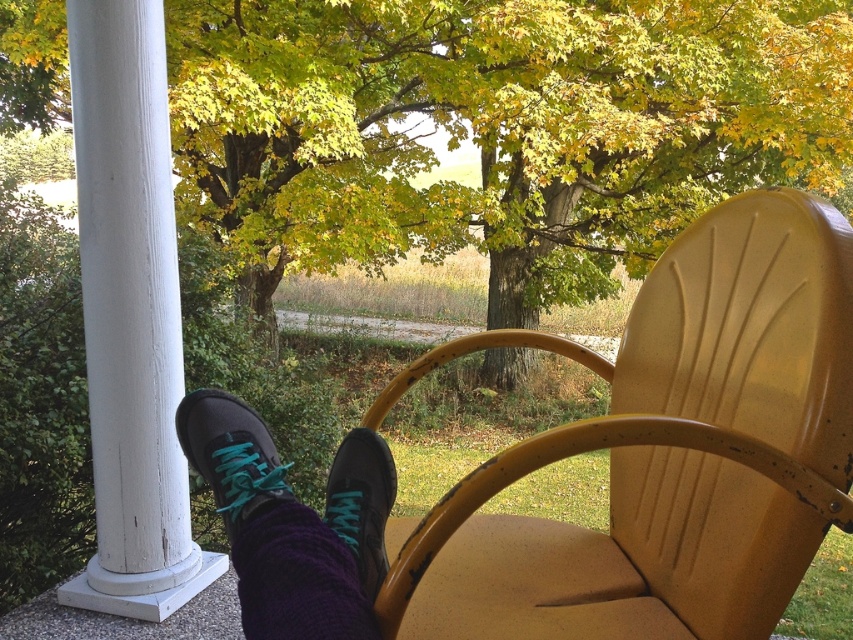
Question: Can you confirm if green leafy tree at upper center is smaller than matte black shoe at center?

Choices:
 (A) no
 (B) yes

Answer: (A)

Question: Which point appears farthest from the camera in this image?

Choices:
 (A) (105, 396)
 (B) (393, 4)
 (C) (352, 499)

Answer: (B)

Question: Which object is the closest to the matte yellow plastic chair at center?

Choices:
 (A) purple knitted sock at lower center
 (B) matte black sneaker at lower left
 (C) green leafy tree at upper center

Answer: (A)

Question: From the image, what is the correct spatial relationship of matte yellow plastic chair at center in relation to matte black sneaker at lower left?

Choices:
 (A) above
 (B) below

Answer: (B)

Question: Is green leafy tree at upper center positioned behind white painted wood column at left?

Choices:
 (A) no
 (B) yes

Answer: (B)

Question: Which of these objects is positioned farthest from the green leafy tree at upper center?

Choices:
 (A) matte yellow plastic chair at center
 (B) white painted wood column at left
 (C) matte black shoes at lower left
 (D) matte black shoe at center

Answer: (C)